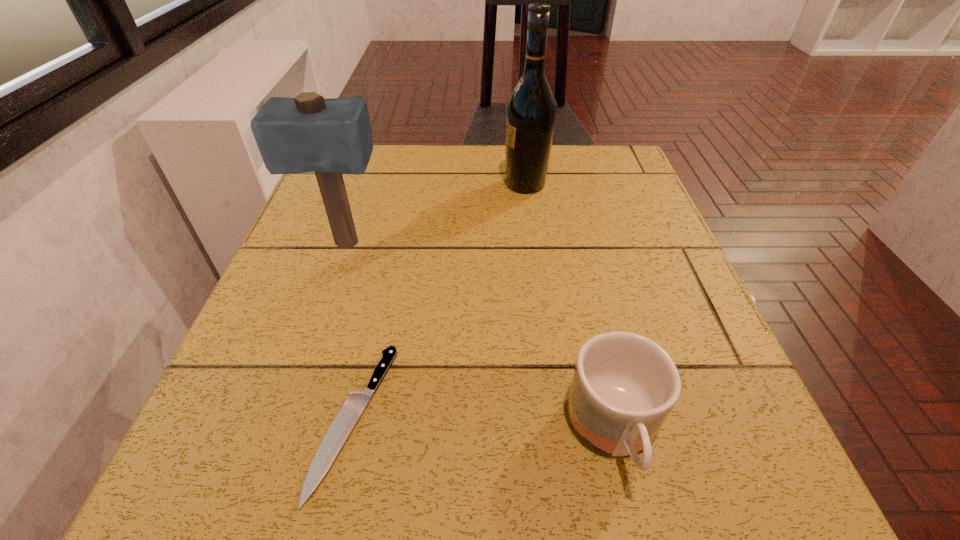
This screenshot has height=540, width=960. In order to click on vacant region between the shortest object and the farthest object in this screenshot , I will do `click(441, 301)`.

This screenshot has height=540, width=960. Identify the location of vacant area that lies between the mug and the mallet. (480, 339).

Where is `vacant region between the farthest object and the mallet`? vacant region between the farthest object and the mallet is located at coordinates (436, 214).

Choose which object is the third nearest neighbor to the tallest object. Please provide its 2D coordinates. Your answer should be formatted as a tuple, i.e. [(x, y)], where the tuple contains the x and y coordinates of a point satisfying the conditions above.

[(624, 386)]

Select which object is the closest to the third tallest object. Please provide its 2D coordinates. Your answer should be formatted as a tuple, i.e. [(x, y)], where the tuple contains the x and y coordinates of a point satisfying the conditions above.

[(344, 422)]

Image resolution: width=960 pixels, height=540 pixels. Find the location of `vacant region that satisfies the following two spatial constraints: 1. on the label of the wine bottle; 2. on the front side of the mallet`. vacant region that satisfies the following two spatial constraints: 1. on the label of the wine bottle; 2. on the front side of the mallet is located at coordinates (534, 245).